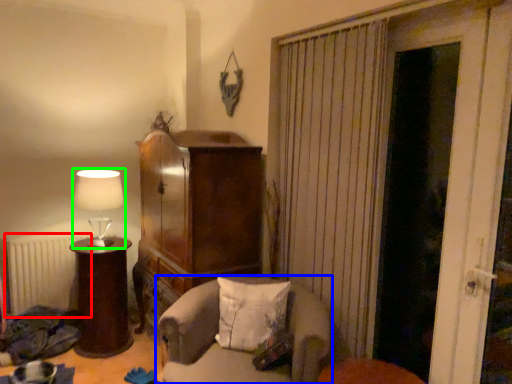
Question: Which object is positioned farthest from radiator (highlighted by a red box)? Select from chair (highlighted by a blue box) and lamp (highlighted by a green box).

Choices:
 (A) chair
 (B) lamp

Answer: (A)